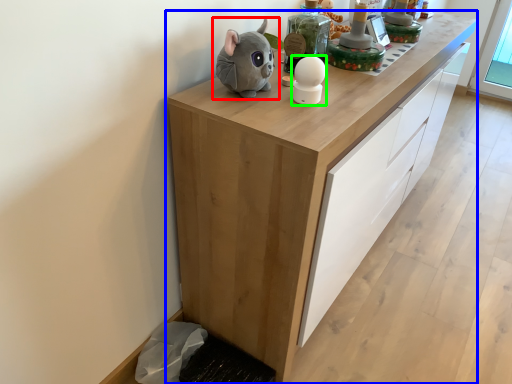
Question: Estimate the real-world distances between objects in this image. Which object is closer to toy (highlighted by a red box), cabinetry (highlighted by a blue box) or toy (highlighted by a green box)?

Choices:
 (A) cabinetry
 (B) toy

Answer: (B)